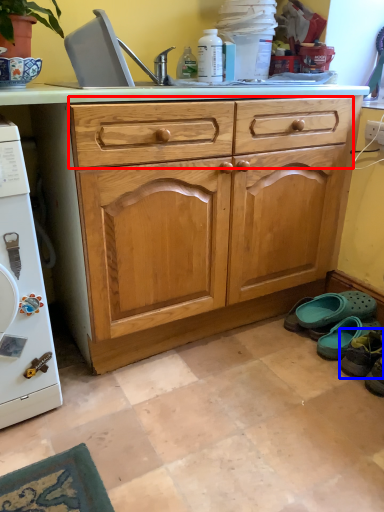
Question: Which object is closer to the camera taking this photo, drawer (highlighted by a red box) or footwear (highlighted by a blue box)?

Choices:
 (A) drawer
 (B) footwear

Answer: (A)